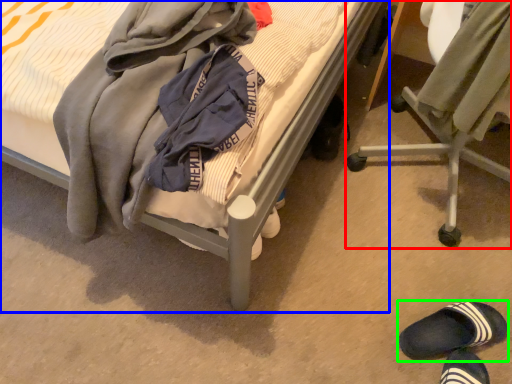
Question: Which object is positioned farthest from chair (highlighted by a red box)? Select from bed (highlighted by a blue box) and footwear (highlighted by a green box).

Choices:
 (A) bed
 (B) footwear

Answer: (B)